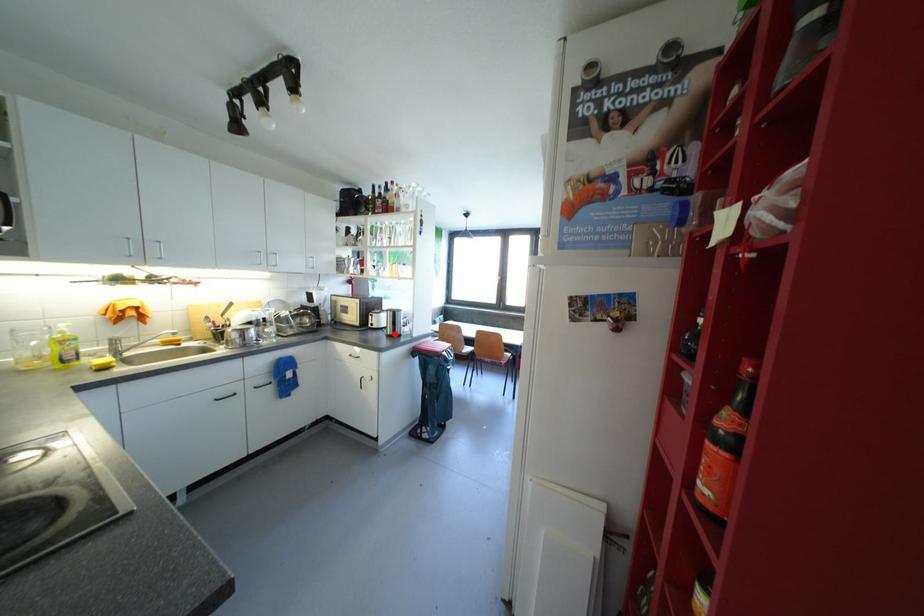
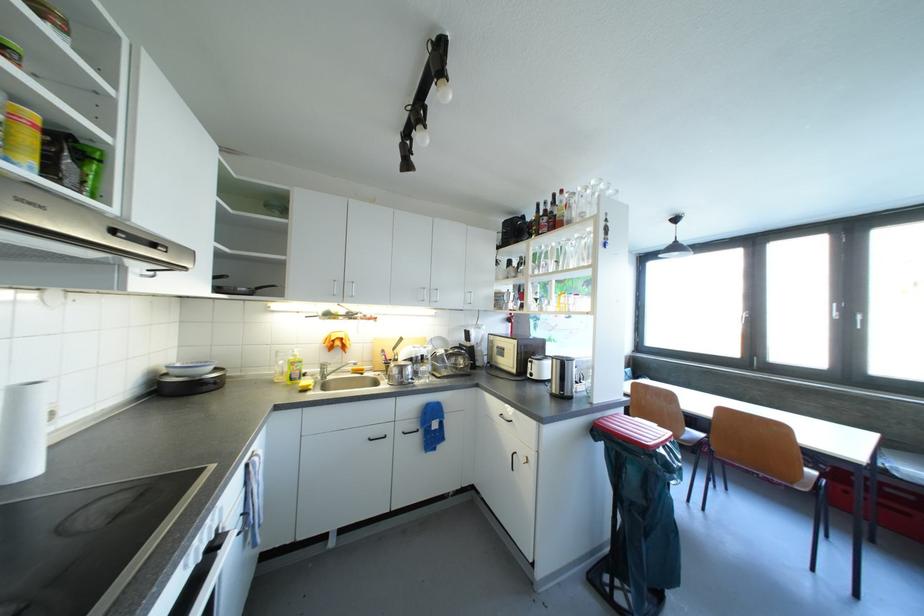
Locate, in the second image, the point that corresponds to the highlighted location in the first image.

(561, 392)